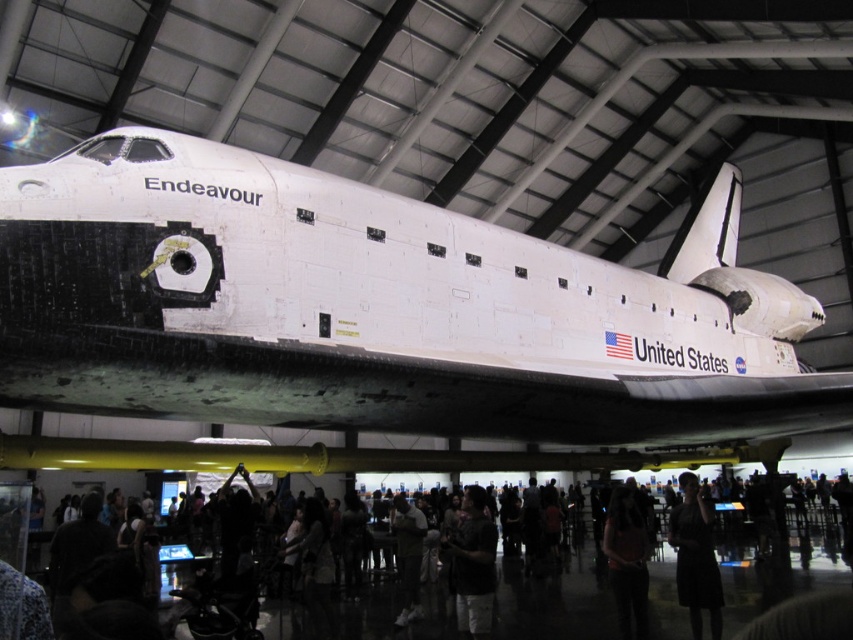
Can you confirm if black dress at lower right is wider than matte pink shirt at center?

Yes.

Which is behind, point (683, 499) or point (613, 525)?

The point (683, 499) is more distant.

Does point (682, 557) come in front of point (625, 627)?

No, (682, 557) is behind (625, 627).

Where is `black dress at lower right`? The height and width of the screenshot is (640, 853). black dress at lower right is located at coordinates (695, 557).

Consider the image. Which is more to the right, dark clothing crowd at lower center or black dress at lower right?

black dress at lower right is more to the right.

The height and width of the screenshot is (640, 853). What do you see at coordinates (555, 600) in the screenshot?
I see `dark clothing crowd at lower center` at bounding box center [555, 600].

Where is `dark clothing crowd at lower center`? The image size is (853, 640). dark clothing crowd at lower center is located at coordinates (555, 600).

Between black dress at lower right and dark gray fabric shirt at center, which one appears on the right side from the viewer's perspective?

From the viewer's perspective, black dress at lower right appears more on the right side.

Who is positioned more to the left, black dress at lower right or dark gray fabric shirt at center?

dark gray fabric shirt at center is more to the left.

This screenshot has width=853, height=640. Find the location of `black dress at lower right`. black dress at lower right is located at coordinates (695, 557).

At what (x,y) coordinates should I click in order to perform the action: click on black dress at lower right. Please return your answer as a coordinate pair (x, y). Looking at the image, I should click on tap(695, 557).